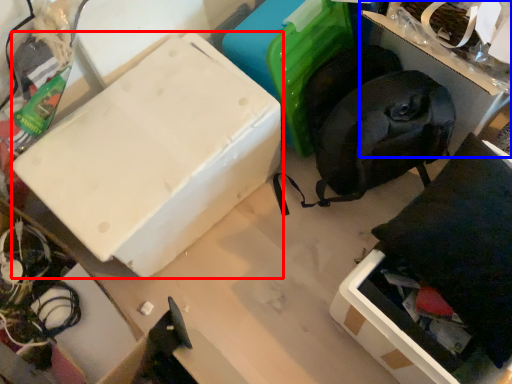
Question: Which of the following is the closest to the observer, box (highlighted by a red box) or storage box (highlighted by a blue box)?

Choices:
 (A) box
 (B) storage box

Answer: (B)